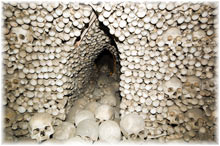
This screenshot has height=146, width=220. Identify the location of wall to left of tunnel. (34, 68).